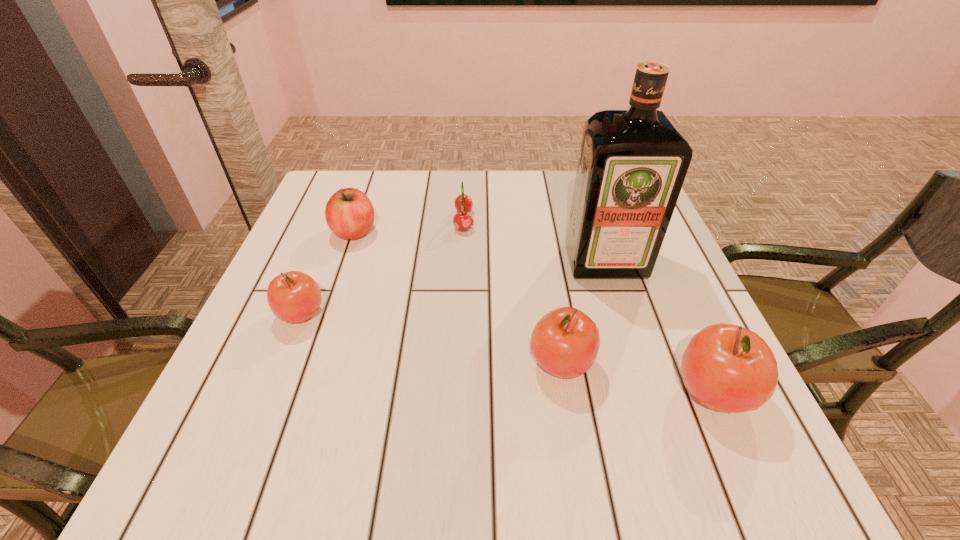
The height and width of the screenshot is (540, 960). In order to click on free area in between the third nearest object and the second tallest apple in this screenshot , I will do `click(431, 339)`.

You are a GUI agent. You are given a task and a screenshot of the screen. Output one action in this format:
    pyautogui.click(x=<x>, y=<y>)
    Task: Click on the free space between the rightmost apple and the fourth farthest object
    The height and width of the screenshot is (540, 960).
    Given the screenshot: What is the action you would take?
    pyautogui.click(x=507, y=353)

At what (x,y) coordinates should I click in order to perform the action: click on free space between the fourth farthest object and the liquor. Please return your answer as a coordinate pair (x, y). The height and width of the screenshot is (540, 960). Looking at the image, I should click on (453, 287).

The height and width of the screenshot is (540, 960). I want to click on empty space between the third nearest apple and the cherry, so click(x=383, y=267).

What are the coordinates of `object that is the third closest one to the third object from left to right` in the screenshot? It's located at (294, 296).

At what (x,y) coordinates should I click in order to perform the action: click on object that can be found as the fifth closest to the third nearest object. Please return your answer as a coordinate pair (x, y). Looking at the image, I should click on (728, 368).

Locate which apple ranks third in proximity to the farthest apple. Please provide its 2D coordinates. Your answer should be formatted as a tuple, i.e. [(x, y)], where the tuple contains the x and y coordinates of a point satisfying the conditions above.

[(728, 368)]

You are a GUI agent. You are given a task and a screenshot of the screen. Output one action in this format:
    pyautogui.click(x=<x>, y=<y>)
    Task: Click on the apple that is the fourth closest to the tallest object
    
    Given the screenshot: What is the action you would take?
    tap(294, 296)

I want to click on vacant space that satisfies the following two spatial constraints: 1. on the front label of the rightmost apple; 2. on the right side of the tallest object, so click(647, 393).

This screenshot has height=540, width=960. I want to click on vacant space that satisfies the following two spatial constraints: 1. with stems pointing upwards on the rightmost apple; 2. on the right side of the cherry, so click(457, 393).